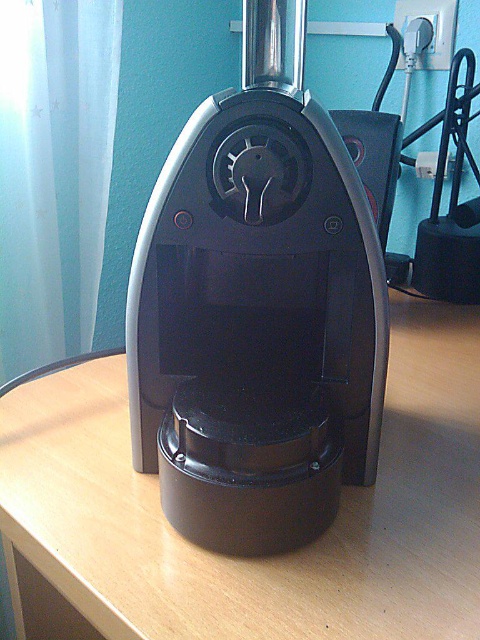
Question: Does black plastic coffee machine at center come behind wooden table at center?

Choices:
 (A) no
 (B) yes

Answer: (B)

Question: Is black plastic coffee machine at center to the left of wooden table at center from the viewer's perspective?

Choices:
 (A) no
 (B) yes

Answer: (B)

Question: Can you confirm if black plastic coffee machine at center is positioned to the right of wooden table at center?

Choices:
 (A) no
 (B) yes

Answer: (A)

Question: Which point is closer to the camera?

Choices:
 (A) (141, 480)
 (B) (354, 429)

Answer: (B)